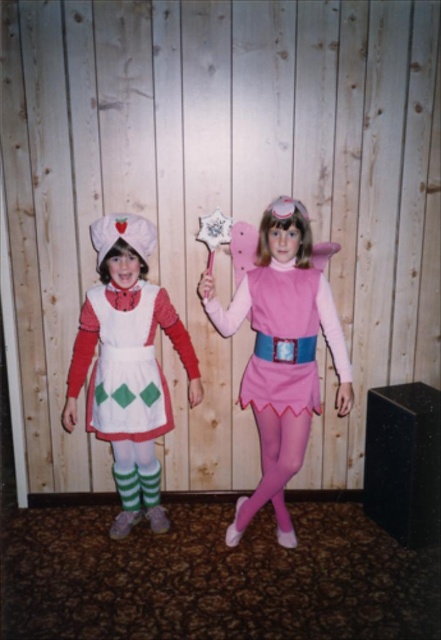
Is matte white dress at left thinner than matte white apron at center?

Incorrect, matte white dress at left's width is not less than matte white apron at center's.

Who is taller, matte white dress at left or matte white apron at center?

Standing taller between the two is matte white dress at left.

The image size is (441, 640). Describe the element at coordinates (281, 353) in the screenshot. I see `matte white dress at left` at that location.

You are a GUI agent. You are given a task and a screenshot of the screen. Output one action in this format:
    pyautogui.click(x=<x>, y=<y>)
    Task: Click on the matte white dress at left
    This screenshot has width=441, height=640.
    Given the screenshot: What is the action you would take?
    pyautogui.click(x=281, y=353)

Can you confirm if matte white dress at left is wider than white matte apron at left?

Yes, matte white dress at left is wider than white matte apron at left.

Does point (134, 513) come behind point (134, 285)?

Yes.

Locate an element on the screen. This screenshot has width=441, height=640. matte white dress at left is located at coordinates (281, 353).

Is matte white apron at center wider than pink satin dress at center?

Incorrect, matte white apron at center's width does not surpass pink satin dress at center's.

Which is in front, point (134, 225) or point (246, 307)?

Positioned in front is point (134, 225).

Measure the distance between point [104,404] and camera.

Point [104,404] and camera are 8.44 feet apart from each other.

Where is `matte white apron at center`? This screenshot has height=640, width=441. matte white apron at center is located at coordinates (127, 365).